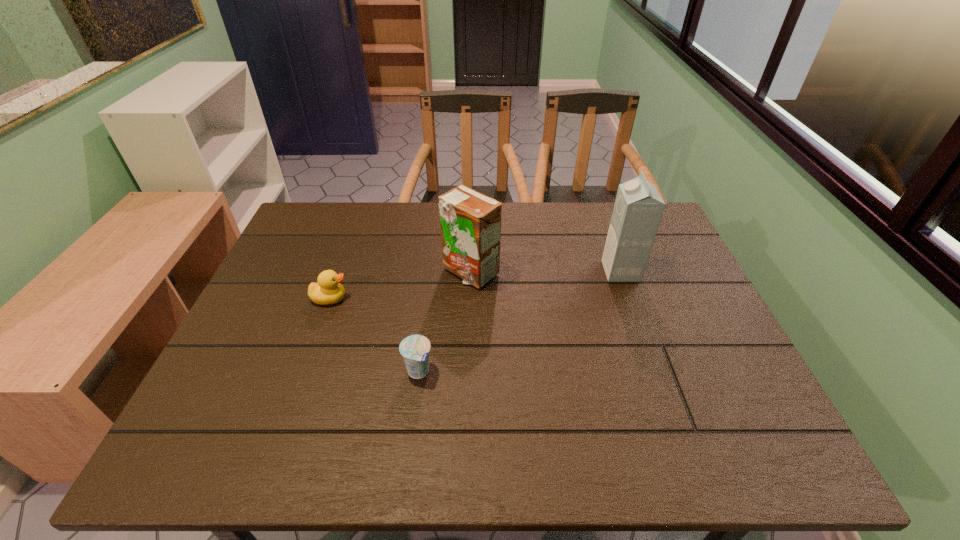
I want to click on vacant space located at the beak of the duck, so click(420, 299).

Where is `free spot located 0.330m on the left of the nearest object`? Image resolution: width=960 pixels, height=540 pixels. free spot located 0.330m on the left of the nearest object is located at coordinates (258, 372).

At what (x,y) coordinates should I click in order to perform the action: click on object that is at the left edge. Please return your answer as a coordinate pair (x, y). Image resolution: width=960 pixels, height=540 pixels. Looking at the image, I should click on 328,290.

You are a GUI agent. You are given a task and a screenshot of the screen. Output one action in this format:
    pyautogui.click(x=<x>, y=<y>)
    Task: Click on the object at the right edge
    This screenshot has width=960, height=540.
    Given the screenshot: What is the action you would take?
    pyautogui.click(x=638, y=208)

The height and width of the screenshot is (540, 960). I want to click on vacant area at the far edge of the desktop, so click(x=558, y=236).

In the image, there is a desktop. Identify the location of vacant region at the near edge. This screenshot has width=960, height=540. (322, 430).

Where is `vacant area at the left edge`? vacant area at the left edge is located at coordinates (297, 275).

Locate an element on the screen. Image resolution: width=960 pixels, height=540 pixels. vacant space at the right edge of the desktop is located at coordinates (698, 359).

This screenshot has width=960, height=540. What are the coordinates of `vacant area at the far left corner of the desktop` in the screenshot? It's located at (340, 213).

Find the location of a particular element. This screenshot has width=960, height=540. blank space at the near left corner of the desktop is located at coordinates (202, 449).